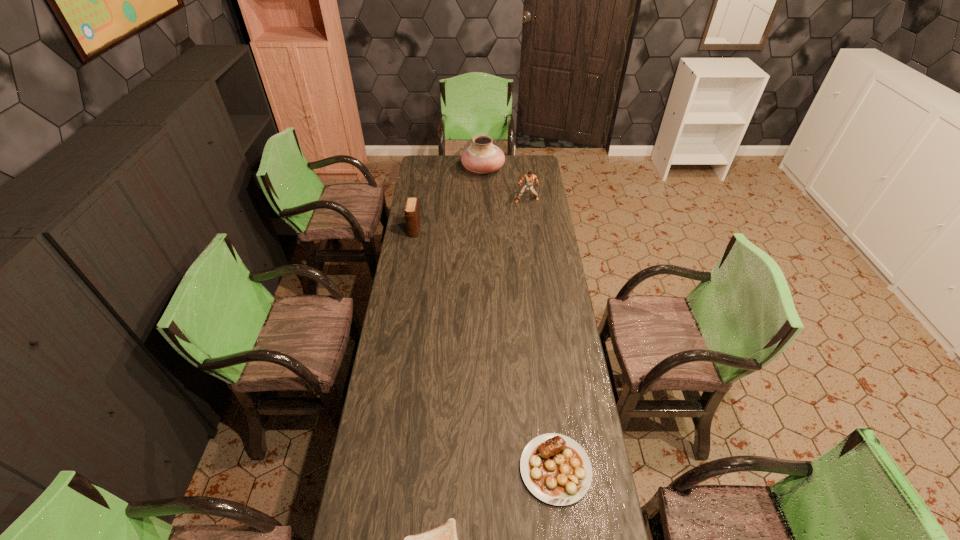
Identify the location of object that is positioned at the far edge. (482, 156).

Identify the location of object at the left edge. The width and height of the screenshot is (960, 540). (412, 213).

Where is `puncher located at the right edge`? puncher located at the right edge is located at coordinates (529, 178).

Where is `steak that is at the right edge`? steak that is at the right edge is located at coordinates (556, 469).

The width and height of the screenshot is (960, 540). In the image, there is a desktop. In order to click on free space at the far edge in this screenshot , I will do `click(453, 162)`.

This screenshot has height=540, width=960. In the image, there is a desktop. In order to click on free region at the left edge in this screenshot , I will do `click(419, 393)`.

In the image, there is a desktop. At what (x,y) coordinates should I click in order to perform the action: click on vacant space at the right edge. Please return your answer as a coordinate pair (x, y). This screenshot has width=960, height=540. Looking at the image, I should click on (539, 265).

Find the location of a particular element. This screenshot has height=540, width=960. blank space at the far right corner is located at coordinates (529, 165).

Where is `free space between the steak and the diary`? This screenshot has height=540, width=960. free space between the steak and the diary is located at coordinates (485, 349).

Image resolution: width=960 pixels, height=540 pixels. I want to click on free space between the puncher and the steak, so click(x=541, y=335).